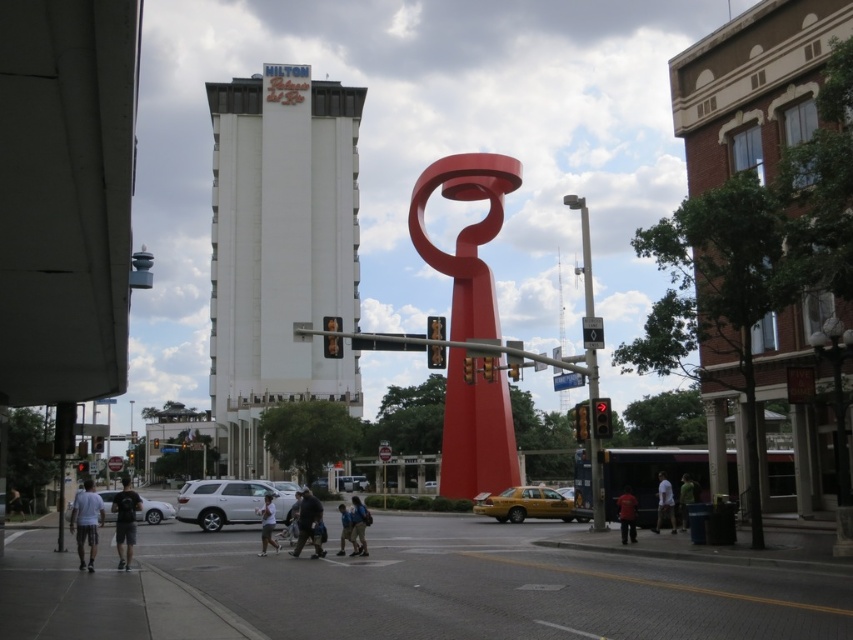
Does metallic pole at right have a greater width compared to dark gray pants at lower center?

Correct, the width of metallic pole at right exceeds that of dark gray pants at lower center.

Looking at this image, which is below, metallic pole at right or dark gray pants at lower center?

dark gray pants at lower center is lower down.

Is point (590, 422) farther from viewer compared to point (317, 545)?

Yes.

Identify the location of metallic pole at right. (595, 442).

Which is more to the left, white smooth building at upper center or metallic pole at right?

white smooth building at upper center

From the picture: Between white smooth building at upper center and metallic pole at right, which one has more height?

Standing taller between the two is white smooth building at upper center.

Find the location of a particular element. Image resolution: width=853 pixels, height=640 pixels. white smooth building at upper center is located at coordinates (279, 250).

Does point (128, 522) come closer to viewer compared to point (351, 532)?

Yes, point (128, 522) is in front of point (351, 532).

Is dark gray t-shirt at lower left positioned in front of light blue denim shorts at lower center?

Yes, dark gray t-shirt at lower left is closer to the viewer.

Who is more distant from viewer, (125, 529) or (344, 545)?

Point (344, 545)

Image resolution: width=853 pixels, height=640 pixels. I want to click on dark gray t-shirt at lower left, so click(125, 522).